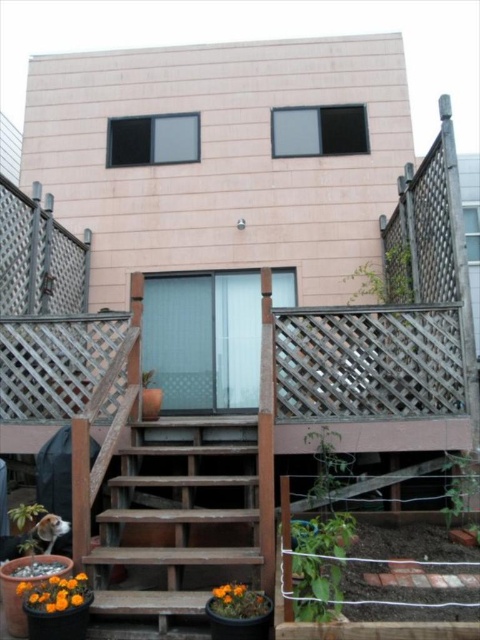
You are standing at the base of the wooden stairs at center and want to place a small potted plant near the orange matte flower at lower left. Can you walk directly to the flower without stepping on the stairs?

The wooden stairs at center are closer to you than the orange matte flower at lower left, so you would need to step off the stairs and walk around to reach the flower.

You are a gardener who needs to water both the green matte plant at lower left and the orange matte flower pot at lower center. The watering can you have can only reach 30 inches. Can you water both plants without moving the can?

The distance between the green matte plant at lower left and the orange matte flower pot at lower center is 35.96 inches, which is greater than the watering can reach of 30 inches. Therefore, you will need to move the watering can to reach both plants.